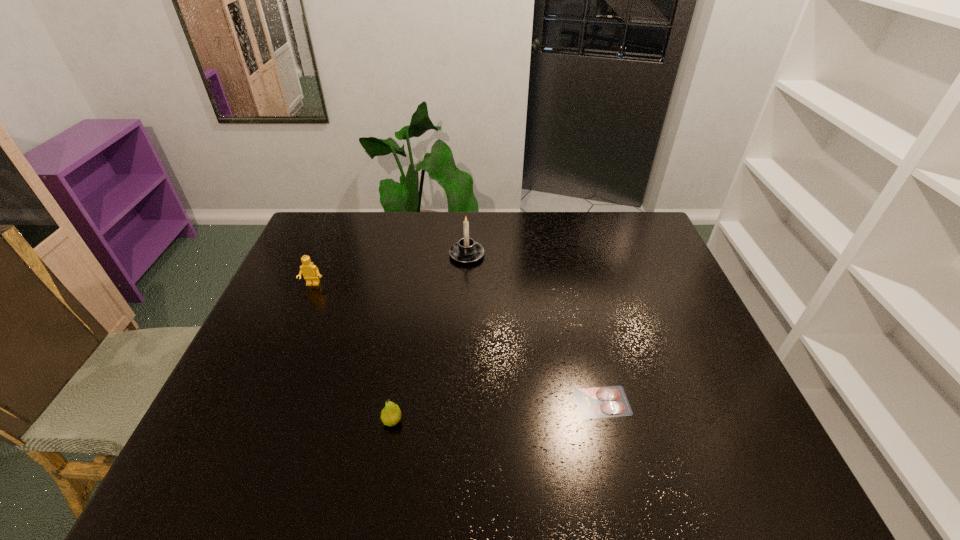
At what (x,y) coordinates should I click in order to perform the action: click on free space located 0.330m on the face of the leftmost object. Please return your answer as a coordinate pair (x, y). The width and height of the screenshot is (960, 540). Looking at the image, I should click on (274, 376).

Identify the location of free spot located 0.110m on the left of the third tallest object. (335, 421).

Find the location of a particular element. This screenshot has width=960, height=540. vacant space positioned 0.060m on the left of the shortest object is located at coordinates (551, 402).

Locate an element on the screen. This screenshot has height=540, width=960. object that is at the far edge is located at coordinates (466, 250).

Where is `object present at the left edge`? Image resolution: width=960 pixels, height=540 pixels. object present at the left edge is located at coordinates (310, 272).

Locate an element on the screen. free space at the far edge of the desktop is located at coordinates (537, 230).

You are a GUI agent. You are given a task and a screenshot of the screen. Output one action in this format:
    pyautogui.click(x=<x>, y=<y>)
    Task: Click on the vacant space at the near edge of the desktop
    This screenshot has width=960, height=540.
    Given the screenshot: What is the action you would take?
    pyautogui.click(x=422, y=481)

Identify the location of free region at the left edge of the desktop. The height and width of the screenshot is (540, 960). pyautogui.click(x=222, y=427).

Identify the location of free point at the right edge. Image resolution: width=960 pixels, height=540 pixels. (669, 370).

The height and width of the screenshot is (540, 960). I want to click on free space at the far right corner of the desktop, so click(x=615, y=226).